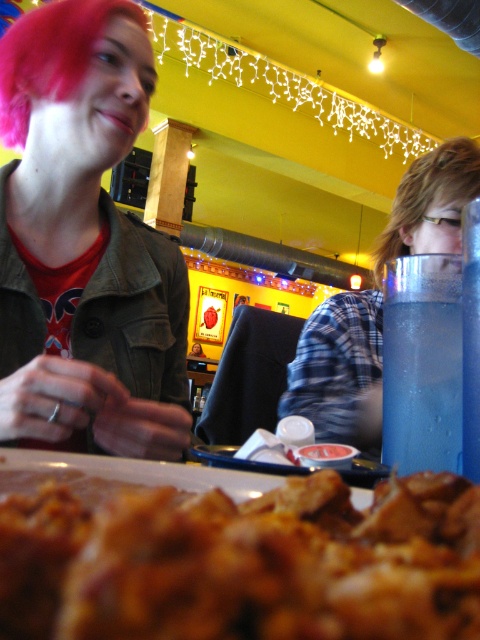
Between point (12, 611) and point (149, 294), which one is positioned in front?

Positioned in front is point (12, 611).

Is brown crispy pastry at center to the left of matte black jacket at upper left from the viewer's perspective?

In fact, brown crispy pastry at center is to the right of matte black jacket at upper left.

Is point (96, 637) positioned after point (47, 228)?

That is False.

At what (x,y) coordinates should I click in order to perform the action: click on brown crispy pastry at center. Please return your answer as a coordinate pair (x, y). This screenshot has height=640, width=480. Looking at the image, I should click on (243, 563).

Is brown crispy pastry at center positioned at the back of blue glass at right?

No, it is not.

Is point (91, 636) positioned in front of point (451, 154)?

That is True.

Identify the location of brown crispy pastry at center. (243, 563).

I want to click on brown crispy pastry at center, so click(243, 563).

Consider the image. Is matte black jacket at upper left wider than blue glass at right?

Incorrect, matte black jacket at upper left's width does not surpass blue glass at right's.

The image size is (480, 640). In order to click on matte black jacket at upper left in this screenshot , I will do `click(84, 241)`.